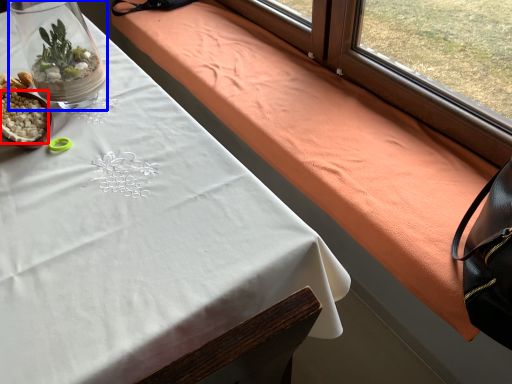
Question: Which point is closer to the camera, food (highlighted by a red box) or glass vase (highlighted by a blue box)?

Choices:
 (A) food
 (B) glass vase

Answer: (B)